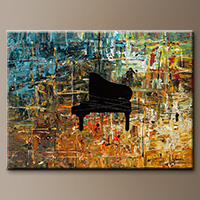
At what (x,y) coordinates should I click in order to perform the action: click on painting. Please return your answer as a coordinate pair (x, y). The width and height of the screenshot is (200, 200). Looking at the image, I should click on (147, 145).